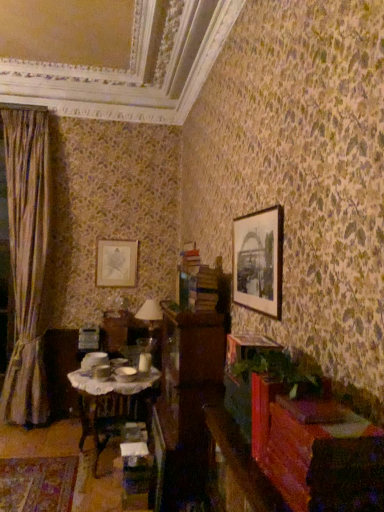
Question: Does matte gold picture frame at upper left, which is counted as the 1th picture frame, starting from the left, lie behind wooden dresser at center?

Choices:
 (A) yes
 (B) no

Answer: (A)

Question: Considering the relative sizes of matte gold picture frame at upper left, the first picture frame viewed from the back, and wooden dresser at center in the image provided, is matte gold picture frame at upper left, the first picture frame viewed from the back, wider than wooden dresser at center?

Choices:
 (A) no
 (B) yes

Answer: (A)

Question: Is wooden dresser at center at the back of matte gold picture frame at upper left, which is counted as the 1th picture frame, starting from the left?

Choices:
 (A) no
 (B) yes

Answer: (A)

Question: Is matte gold picture frame at upper left, which is counted as the 1th picture frame, starting from the left, not within wooden dresser at center?

Choices:
 (A) no
 (B) yes

Answer: (B)

Question: Could you tell me if matte gold picture frame at upper left, the first picture frame viewed from the back, is facing wooden dresser at center?

Choices:
 (A) yes
 (B) no

Answer: (A)

Question: From a real-world perspective, is matte gold picture frame at upper left, which is counted as the 1th picture frame, starting from the left, beneath wooden dresser at center?

Choices:
 (A) yes
 (B) no

Answer: (B)

Question: Would you say matte black picture frame at upper right, placed as the 1th picture frame when sorted from right to left, is part of silky beige curtain at left's contents?

Choices:
 (A) yes
 (B) no

Answer: (B)

Question: Can you confirm if silky beige curtain at left is smaller than matte black picture frame at upper right, the 2th picture frame in the back-to-front sequence?

Choices:
 (A) yes
 (B) no

Answer: (B)

Question: Is silky beige curtain at left facing towards matte black picture frame at upper right, placed as the 1th picture frame when sorted from right to left?

Choices:
 (A) yes
 (B) no

Answer: (B)

Question: Can we say silky beige curtain at left lies outside matte black picture frame at upper right, positioned as the second picture frame in left-to-right order?

Choices:
 (A) yes
 (B) no

Answer: (A)

Question: From the image's perspective, is silky beige curtain at left under matte black picture frame at upper right, positioned as the second picture frame in left-to-right order?

Choices:
 (A) no
 (B) yes

Answer: (B)

Question: From a real-world perspective, is silky beige curtain at left over matte black picture frame at upper right, the 2th picture frame in the back-to-front sequence?

Choices:
 (A) no
 (B) yes

Answer: (A)

Question: From the image's perspective, would you say matte black picture frame at upper right, the 2th picture frame in the back-to-front sequence, is positioned over wooden table with lace cloth at center?

Choices:
 (A) yes
 (B) no

Answer: (A)